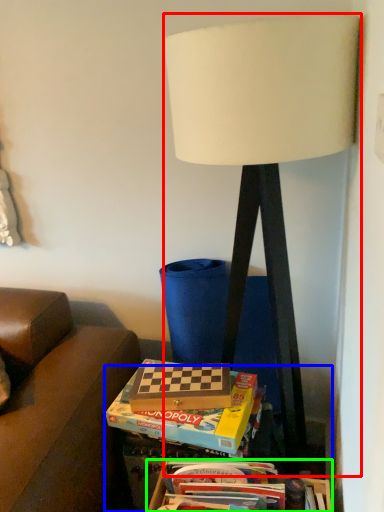
Question: Which object is the closest to the lamp (highlighted by a red box)? Choose among these: table (highlighted by a blue box) or box (highlighted by a green box).

Choices:
 (A) table
 (B) box

Answer: (A)